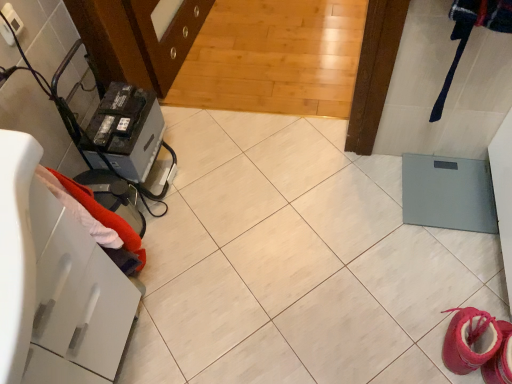
Image resolution: width=512 pixels, height=384 pixels. Identify the location of black plastic battery at left. (128, 130).

Where is `pink suede booties at lower right`? pink suede booties at lower right is located at coordinates (471, 339).

The height and width of the screenshot is (384, 512). I want to click on black plastic battery at left, so click(128, 130).

How distant is black plastic battery at left from red fabric towel at left?

black plastic battery at left and red fabric towel at left are 11.03 inches apart from each other.

Looking at this image, is black plastic battery at left next to red fabric towel at left and touching it?

No, black plastic battery at left is not with red fabric towel at left.

Is black plastic battery at left inside or outside of red fabric towel at left?

black plastic battery at left cannot be found inside red fabric towel at left.

Is point (91, 162) closer or farther from the camera than point (63, 182)?

Point (91, 162).

Considering the sizes of objects white glossy drawer at left and red fabric towel at left in the image provided, who is taller, white glossy drawer at left or red fabric towel at left?

white glossy drawer at left.

From a real-world perspective, which is physically above, white glossy drawer at left or red fabric towel at left?

In real-world perspective, red fabric towel at left is above.

From the image's perspective, is white glossy drawer at left above or below red fabric towel at left?

white glossy drawer at left is below red fabric towel at left.

Would you say white glossy drawer at left is a long distance from red fabric towel at left?

white glossy drawer at left is near red fabric towel at left, not far away.

From the picture: How far apart are white glossy drawer at left and black plastic battery at left?

They are 18.37 inches apart.

From a real-world perspective, who is located higher, white glossy drawer at left or black plastic battery at left?

white glossy drawer at left.

You are a GUI agent. You are given a task and a screenshot of the screen. Output one action in this format:
    pyautogui.click(x=<x>, y=<y>)
    Task: Click on the drawer positioned vertically above the black plastic battery at left (from a real-world perspective)
    The image size is (512, 384).
    Given the screenshot: What is the action you would take?
    pyautogui.click(x=86, y=303)

Between white glossy drawer at left and black plastic battery at left, which one has more height?

With more height is white glossy drawer at left.

Can you confirm if pink suede booties at lower right is positioned to the left of red fabric towel at left?

In fact, pink suede booties at lower right is to the right of red fabric towel at left.

Looking at this image, which is less distant, (466, 357) or (69, 191)?

Clearly, point (466, 357) is more distant from the camera than point (69, 191).

Could you tell me if pink suede booties at lower right is facing red fabric towel at left?

No, pink suede booties at lower right is not aimed at red fabric towel at left.

Between pink suede booties at lower right and red fabric towel at left, which one has less height?

pink suede booties at lower right.

Is black plastic battery at left to the right of white glossy drawer at left from the viewer's perspective?

Correct, you'll find black plastic battery at left to the right of white glossy drawer at left.

Considering the sizes of black plastic battery at left and white glossy drawer at left in the image, is black plastic battery at left taller or shorter than white glossy drawer at left?

black plastic battery at left is shorter than white glossy drawer at left.

Would you say black plastic battery at left is a long distance from white glossy drawer at left?

They are positioned close to each other.

Is black plastic battery at left oriented towards white glossy drawer at left?

No, black plastic battery at left is not aimed at white glossy drawer at left.

Which is behind, point (129, 289) or point (448, 352)?

The point (129, 289) is farther from the camera.

Can you confirm if white glossy drawer at left is thinner than pink suede booties at lower right?

Incorrect, the width of white glossy drawer at left is not less than that of pink suede booties at lower right.

Is pink suede booties at lower right located within white glossy drawer at left?

No, white glossy drawer at left does not contain pink suede booties at lower right.

Who is shorter, white glossy drawer at left or pink suede booties at lower right?

pink suede booties at lower right is shorter.

Can you confirm if red fabric towel at left is thinner than white glossy drawer at left?

Indeed, red fabric towel at left has a lesser width compared to white glossy drawer at left.

Does point (130, 240) appear closer or farther from the camera than point (111, 362)?

Point (130, 240) is closer to the camera than point (111, 362).

Can you see red fabric towel at left touching white glossy drawer at left?

red fabric towel at left and white glossy drawer at left are not in contact.

This screenshot has width=512, height=384. Find the location of `clothing that appears behind the white glossy drawer at left`. clothing that appears behind the white glossy drawer at left is located at coordinates (104, 216).

In order to click on appliance to the left of red fabric towel at left in this screenshot , I will do `click(128, 130)`.

Find the location of `clothing above the white glossy drawer at left (from the image's perspective)`. clothing above the white glossy drawer at left (from the image's perspective) is located at coordinates (104, 216).

Which object lies further to the anchor point pink suede booties at lower right, white glossy drawer at left or red fabric towel at left?

white glossy drawer at left is positioned further to the anchor pink suede booties at lower right.

When comparing their distances from white glossy drawer at left, does pink suede booties at lower right or black plastic battery at left seem further?

Based on the image, pink suede booties at lower right appears to be further to white glossy drawer at left.

Estimate the real-world distances between objects in this image. Which object is closer to pink suede booties at lower right, white glossy drawer at left or black plastic battery at left?

Based on the image, white glossy drawer at left appears to be nearer to pink suede booties at lower right.

Which object lies nearer to the anchor point pink suede booties at lower right, black plastic battery at left or white glossy drawer at left?

white glossy drawer at left lies closer to pink suede booties at lower right than the other object.

Which object lies nearer to the anchor point red fabric towel at left, black plastic battery at left or pink suede booties at lower right?

The object closer to red fabric towel at left is black plastic battery at left.

Estimate the real-world distances between objects in this image. Which object is further from white glossy drawer at left, red fabric towel at left or pink suede booties at lower right?

The object further to white glossy drawer at left is pink suede booties at lower right.

Based on their spatial positions, is red fabric towel at left or black plastic battery at left further from pink suede booties at lower right?

Based on the image, black plastic battery at left appears to be further to pink suede booties at lower right.

Considering their positions, is white glossy drawer at left positioned further to black plastic battery at left than pink suede booties at lower right?

Among the two, pink suede booties at lower right is located further to black plastic battery at left.

You are a GUI agent. You are given a task and a screenshot of the screen. Output one action in this format:
    pyautogui.click(x=<x>, y=<y>)
    Task: Click on the clothing between white glossy drawer at left and pink suede booties at lower right from left to right
    The image size is (512, 384).
    Given the screenshot: What is the action you would take?
    [x=104, y=216]

Identify the location of clothing located between white glossy drawer at left and black plastic battery at left in the depth direction. (104, 216).

The width and height of the screenshot is (512, 384). In order to click on clothing between black plastic battery at left and pink suede booties at lower right in this screenshot , I will do `click(104, 216)`.

You are a GUI agent. You are given a task and a screenshot of the screen. Output one action in this format:
    pyautogui.click(x=<x>, y=<y>)
    Task: Click on the appliance situated between white glossy drawer at left and pink suede booties at lower right from left to right
    
    Given the screenshot: What is the action you would take?
    pyautogui.click(x=128, y=130)